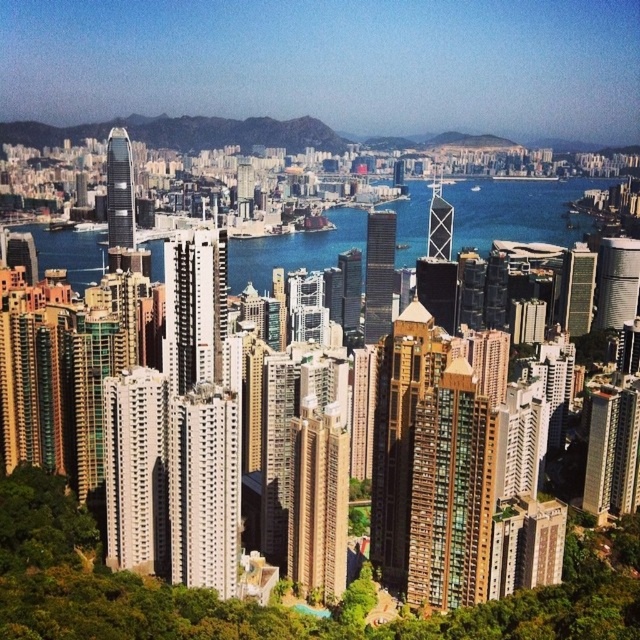
Question: Can you confirm if white smooth building at center is positioned above matte glass building at center?

Choices:
 (A) no
 (B) yes

Answer: (A)

Question: Can you confirm if glassy steel skyscraper at center is thinner than shiny glass skyscraper at center?

Choices:
 (A) no
 (B) yes

Answer: (B)

Question: Does metallic glass skyscraper at center-right appear on the left side of glassy reflective skyscraper at center?

Choices:
 (A) no
 (B) yes

Answer: (A)

Question: Which point is farther to the camera?

Choices:
 (A) (376, 264)
 (B) (74, 252)
 (C) (602, 508)
 (D) (424, 540)

Answer: (B)

Question: Which point is farther from the camera taking this photo?

Choices:
 (A) (118, 150)
 (B) (432, 513)

Answer: (A)

Question: Which is farther from the glassy steel skyscraper at center?

Choices:
 (A) sleek silver skyscraper at center-right
 (B) shiny glass skyscraper at center
 (C) green glass skyscraper at center-right

Answer: (B)